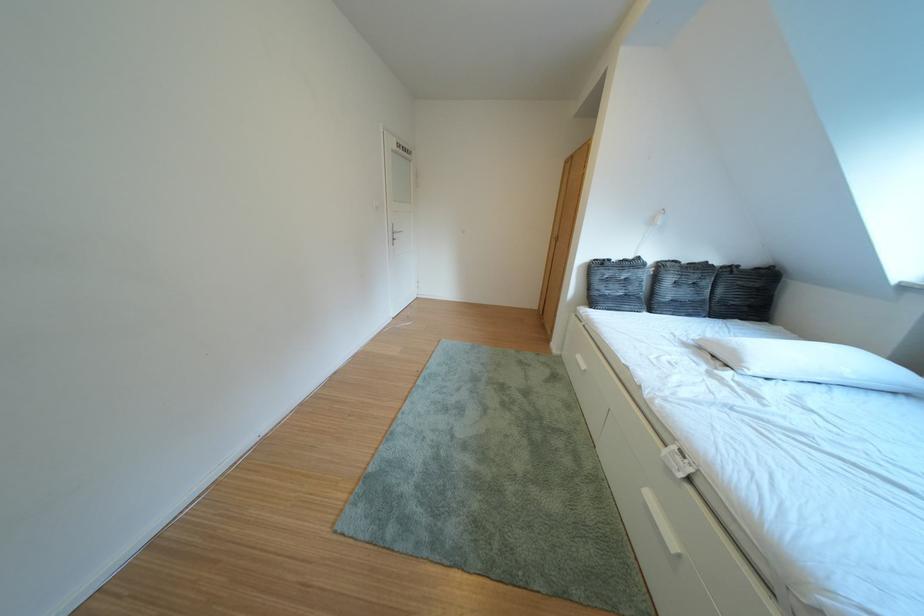
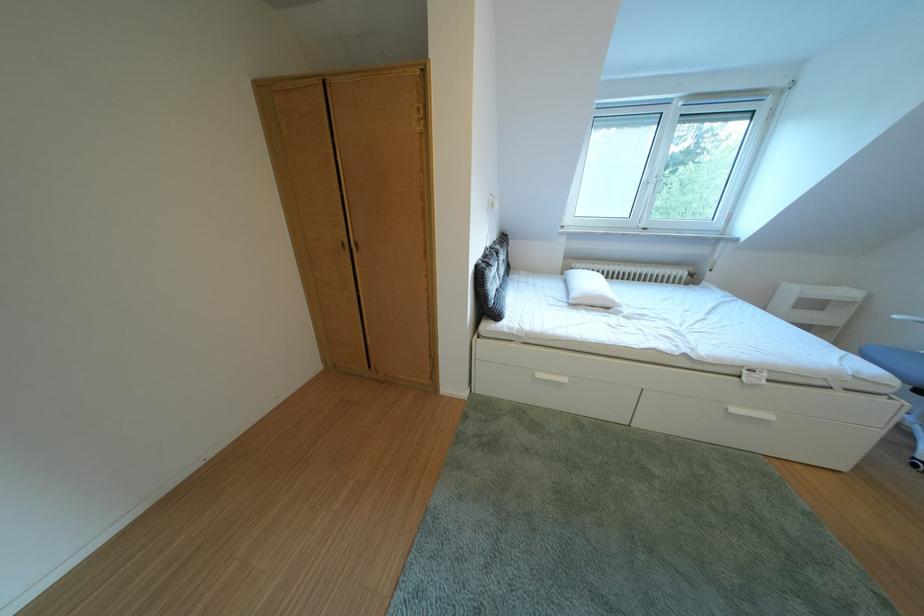
Find the pixel in the second image that matches (x=662, y=500) in the first image.

(748, 415)